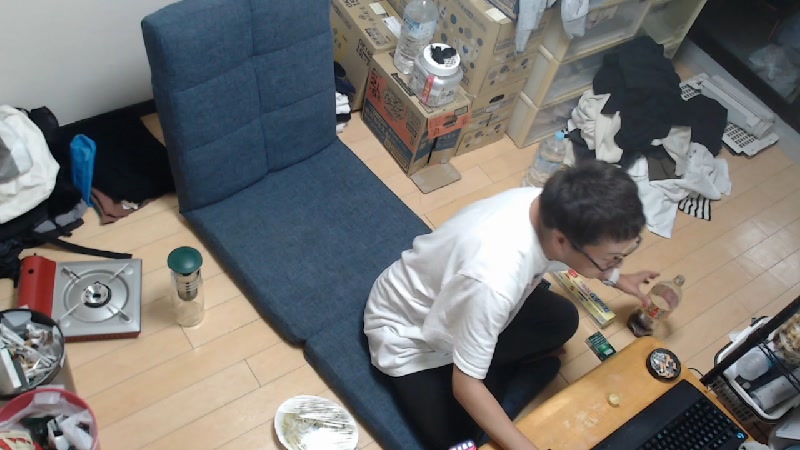
Locate an element on the screen. bottle lid is located at coordinates click(x=617, y=401).